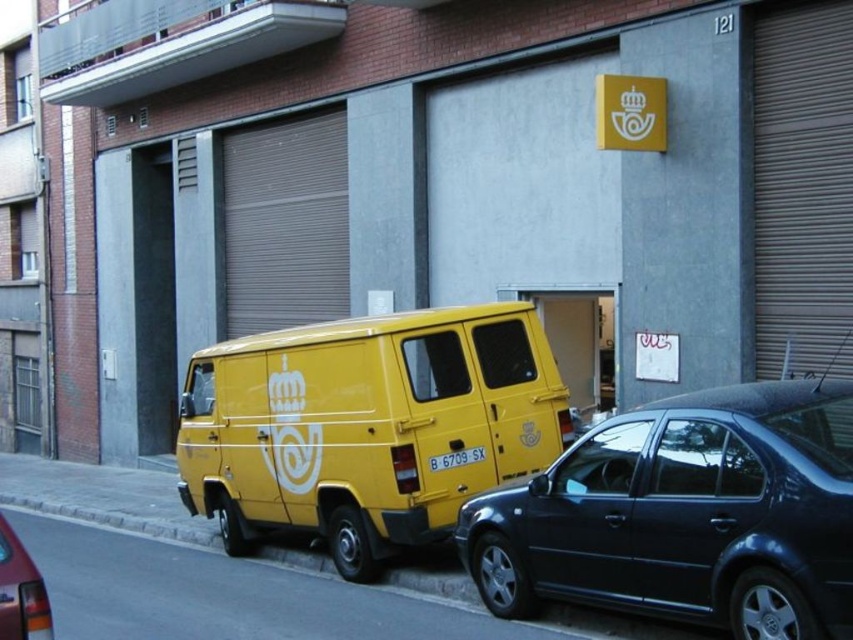
Question: From the image, what is the correct spatial relationship of yellow matte van at center in relation to shiny red tail light at lower left?

Choices:
 (A) left
 (B) right

Answer: (B)

Question: Which of the following is the farthest from the observer?

Choices:
 (A) (461, 461)
 (B) (616, 420)
 (C) (235, 355)
 (D) (543, 630)

Answer: (C)

Question: Where is metallic dark blue sedan at center located in relation to shiny red tail light at lower left in the image?

Choices:
 (A) right
 (B) left

Answer: (A)

Question: Which point is closer to the camera?

Choices:
 (A) concrete at lower left
 (B) metallic dark blue sedan at center
 (C) yellow matte license plate at center
 (D) yellow matte van at center

Answer: (B)

Question: Does concrete at lower left have a lesser width compared to yellow matte license plate at center?

Choices:
 (A) yes
 (B) no

Answer: (B)

Question: Which object is positioned farthest from the metallic dark blue sedan at center?

Choices:
 (A) shiny red tail light at lower left
 (B) yellow matte license plate at center
 (C) yellow matte van at center
 (D) concrete at lower left

Answer: (A)